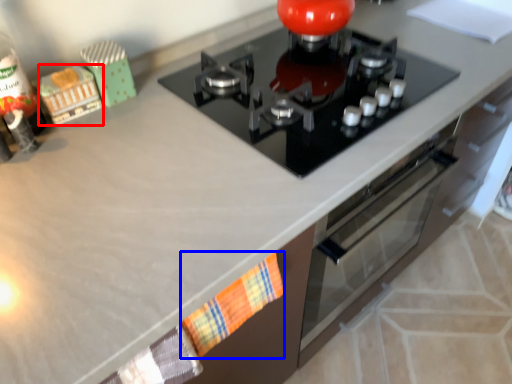
Question: Which object is closer to the camera taking this photo, toy (highlighted by a red box) or hand towel (highlighted by a blue box)?

Choices:
 (A) toy
 (B) hand towel

Answer: (B)